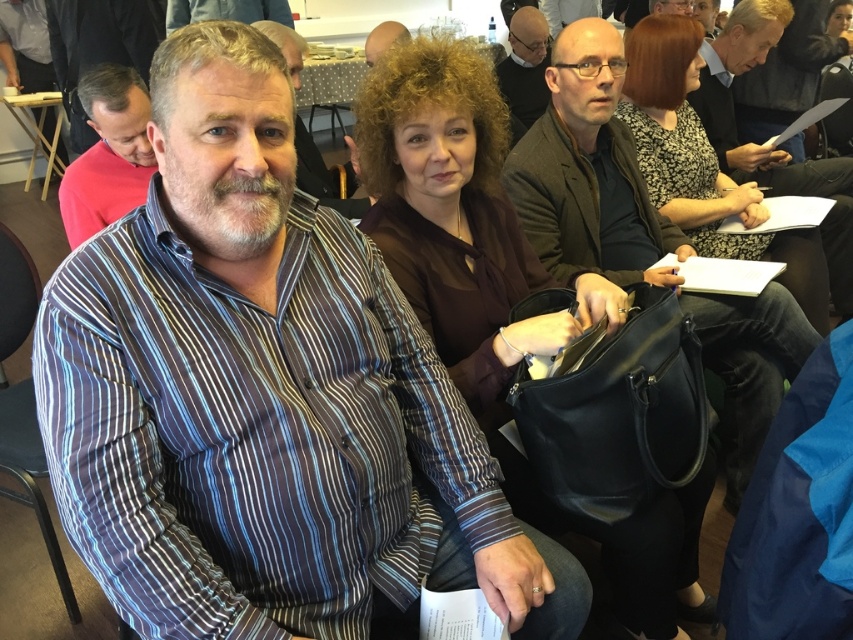
Question: Among these objects, which one is farthest from the camera?

Choices:
 (A) brown leather handbag at center
 (B) matte brown hair at upper right

Answer: (B)

Question: Can you confirm if striped cotton shirt at center is thinner than matte black shirt at center?

Choices:
 (A) yes
 (B) no

Answer: (B)

Question: Among these points, which one is nearest to the camera?

Choices:
 (A) (641, 141)
 (B) (784, 48)
 (C) (515, 10)

Answer: (A)

Question: Is brown leather handbag at center closer to camera compared to floral-patterned fabric purse at center?

Choices:
 (A) no
 (B) yes

Answer: (B)

Question: Which point is farther to the camera?

Choices:
 (A) brown leather handbag at center
 (B) matte red shirt at left
 (C) matte brown hair at upper right

Answer: (C)

Question: Can you confirm if matte black jacket at center is thinner than matte brown hair at upper right?

Choices:
 (A) no
 (B) yes

Answer: (A)